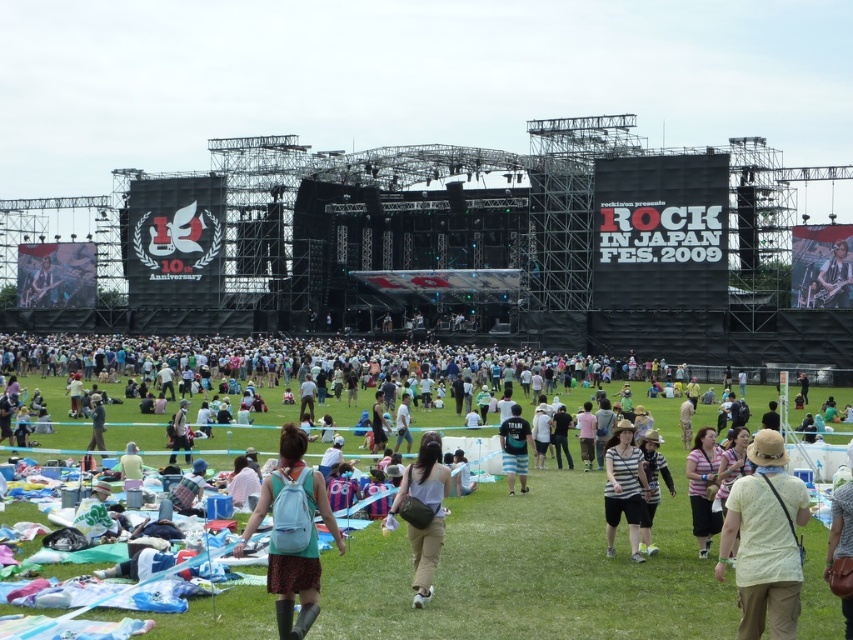
You are a photographer at the festival and want to take a photo of both the light blue fabric backpack at center and the light brown fabric pants at center. Since you can only focus on one object at a time, which object should you focus on first to ensure the other remains in the background?

You should focus on the light blue fabric backpack at center first because it is closer to the viewer than the light brown fabric pants at center. By focusing on the closer object, the farther one will naturally stay in the background.

You are a photographer at the Rock in Japan Fes. 2009 festival. You want to take a photo of the crowd from your current position. You notice two points in the crowd at coordinates point (428, 522) and point (709, 541). Which point will appear larger in your photo?

Point (428, 522) is closer to the camera than point (709, 541). Since objects closer to the camera appear larger in a photo, point (428, 522) will appear larger in the photo.

You are a photographer at the festival and want to capture a candid shot of the attendee wearing the light brown fabric pants at center and the striped fabric shirt at center. Since you want to focus on their clothing details, which clothing item should you zoom in on to ensure it occupies more of the frame?

The light brown fabric pants at center has a greater width than the striped fabric shirt at center, so zooming in on the light brown fabric pants at center will ensure it occupies more of the frame.